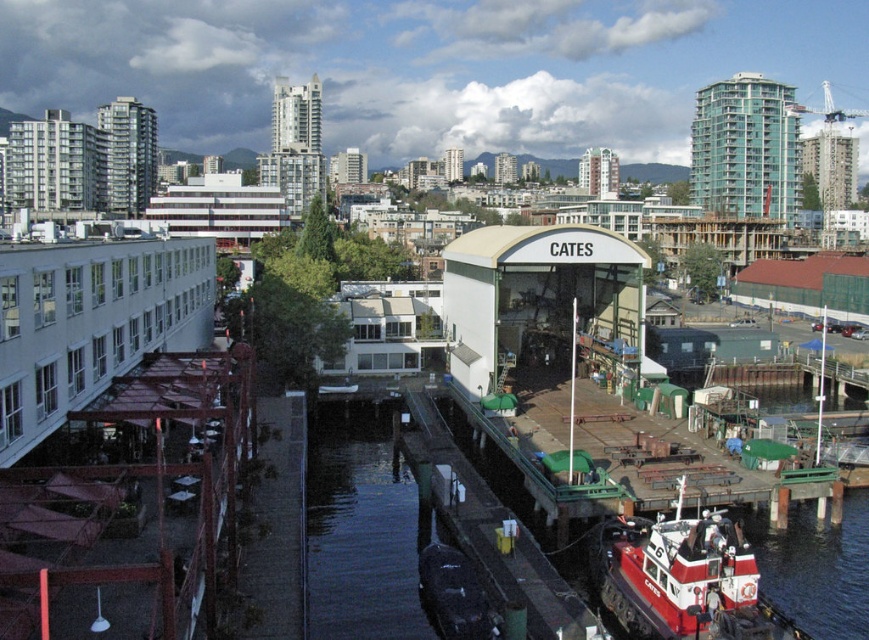
You are standing at the edge of the waterway in the waterfront scene, looking towards the CATES building. There are two points marked on the waterway. Which point is closer to you, point 1 at coordinates (180,540) or point 2 at coordinates (588,612)?

Point 1 at coordinates (180,540) is closer to you because it is further to the viewer than point 2 at coordinates (588,612).

You are a delivery person needing to transport a 100 foot long cargo container from the rustic wood dock at lower left to the red painted steel tugboat at lower right. Can you safely move the container between them without it getting stuck?

The distance between the rustic wood dock at lower left and the red painted steel tugboat at lower right is 80.49 feet. Since the cargo container is 100 feet long, it cannot be moved between them without getting stuck as the distance is shorter than the container.

You are a delivery person trying to locate the rustic wood dock at lower left for unloading packages. Using the coordinate system where the bottom left corner of the image is the origin, can you confirm if the dock is positioned at point 0.789, 0.153?

Yes, the rustic wood dock at lower left is positioned at point (131, 504) according to the coordinates provided.